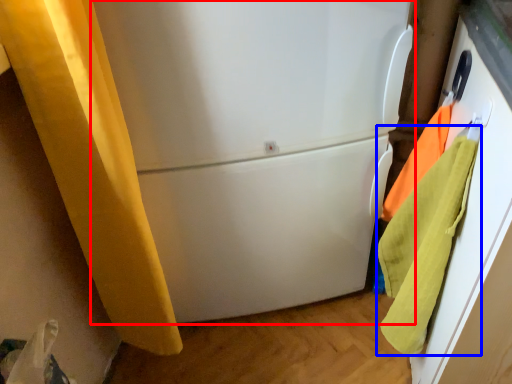
Question: Among these objects, which one is farthest to the camera, refrigerator (highlighted by a red box) or beach towel (highlighted by a blue box)?

Choices:
 (A) refrigerator
 (B) beach towel

Answer: (A)